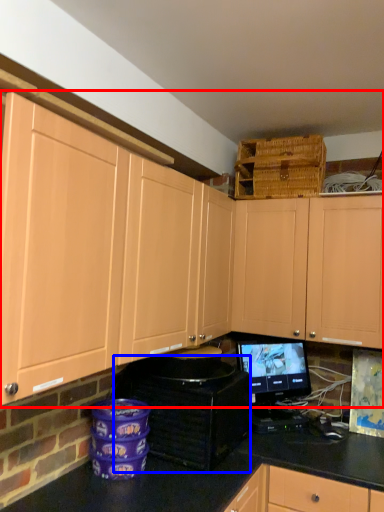
Question: Among these objects, which one is farthest to the camera, cabinetry (highlighted by a red box) or appliance (highlighted by a blue box)?

Choices:
 (A) cabinetry
 (B) appliance

Answer: (B)